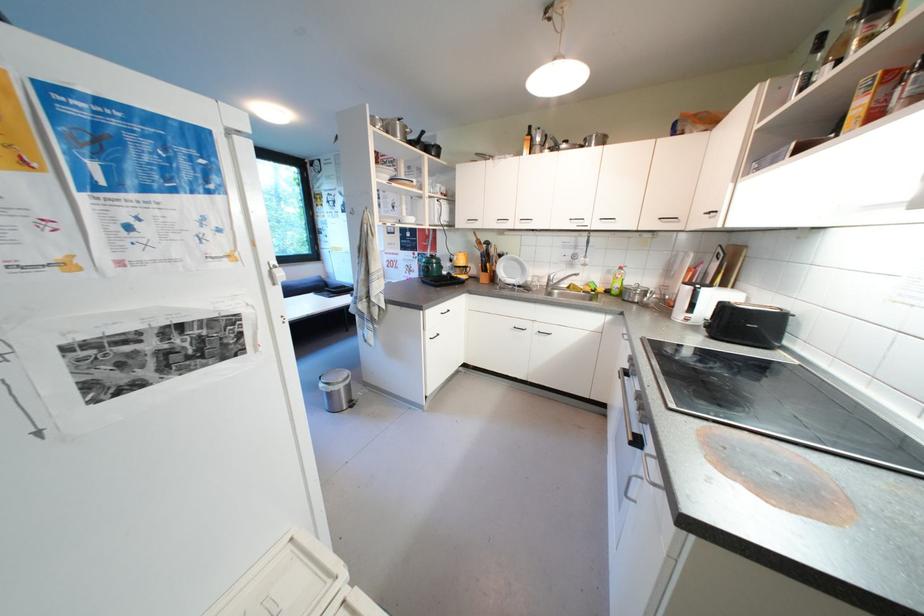
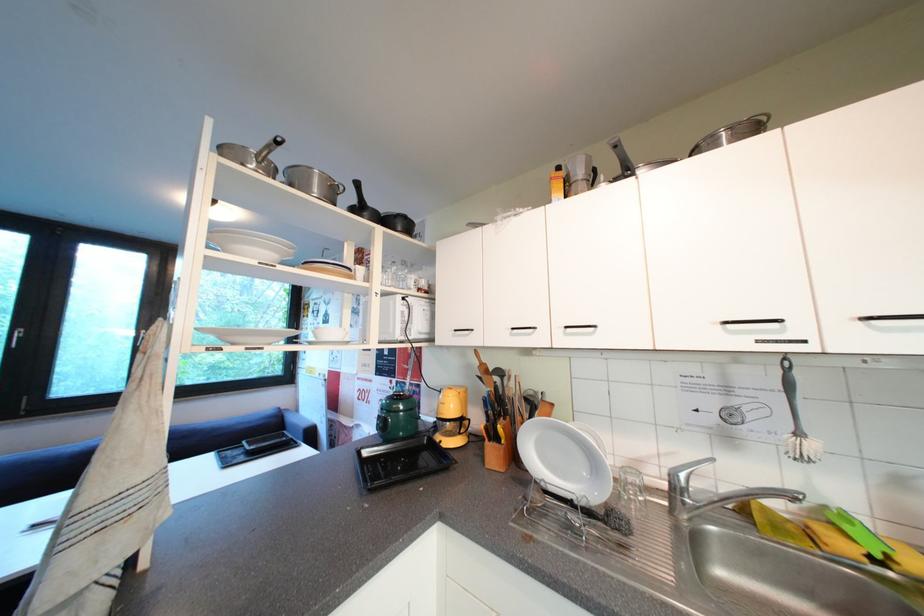
Question: In a continuous first-person perspective shot, in which direction is the camera moving?

Choices:
 (A) Left
 (B) Right
 (C) Forward
 (D) Backward

Answer: (C)